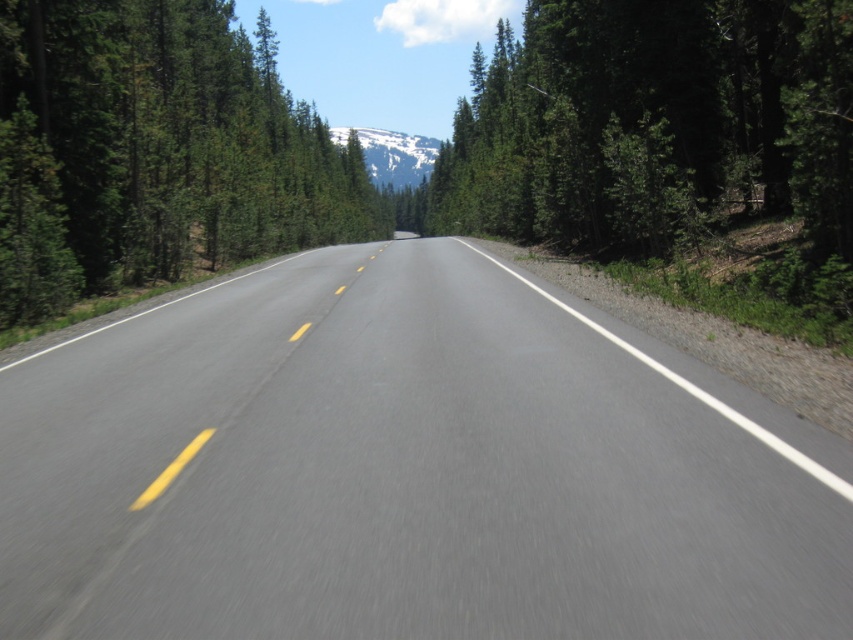
You are driving a car and need to stay within the lanes on the smooth asphalt road at center. Which side of the road should you avoid crossing to stay between the green matte tree at left and the road edge?

You should avoid crossing the white solid line on the right side of the smooth asphalt road at center to stay between the green matte tree at left and the road edge.

You are a driver approaching the road. You see a point marked at coordinates (x=155, y=150). What object does this point correspond to?

The point at coordinates (x=155, y=150) corresponds to the green matte tree at left.

You are a hiker standing at the starting point of the trail. You see the smooth asphalt road at center and the snowy white mountain at center. Which one is closer to the ground?

The smooth asphalt road at center is closer to the ground compared to the snowy white mountain at center since it has a lesser height.